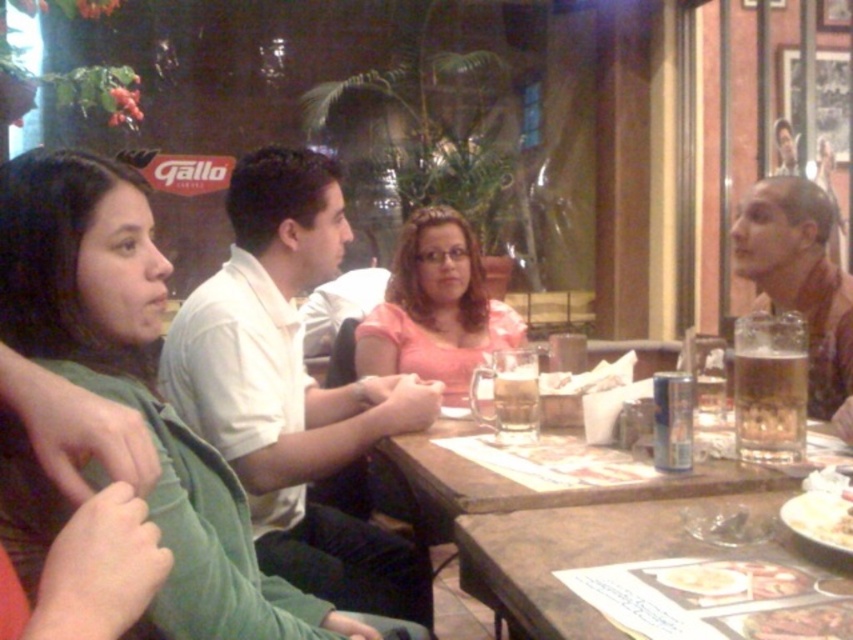
Question: Which point is closer to the camera?

Choices:
 (A) smooth brown leather jacket at right
 (B) brown wooden table at center

Answer: (B)

Question: Is smooth brown leather jacket at right positioned in front of white paper plate at lower right?

Choices:
 (A) no
 (B) yes

Answer: (A)

Question: Among these objects, which one is nearest to the camera?

Choices:
 (A) brown leather table at center
 (B) smooth brown bread at lower right
 (C) translucent glass mug at right
 (D) white paper plate at lower right

Answer: (B)

Question: Does white cotton shirt at center lie behind white glossy plate at lower right?

Choices:
 (A) no
 (B) yes

Answer: (B)

Question: Does smooth brown leather jacket at right lie behind white paper plate at lower right?

Choices:
 (A) yes
 (B) no

Answer: (A)

Question: Which point is closer to the camera?

Choices:
 (A) translucent glass beer at table center
 (B) brown wooden table at center

Answer: (B)